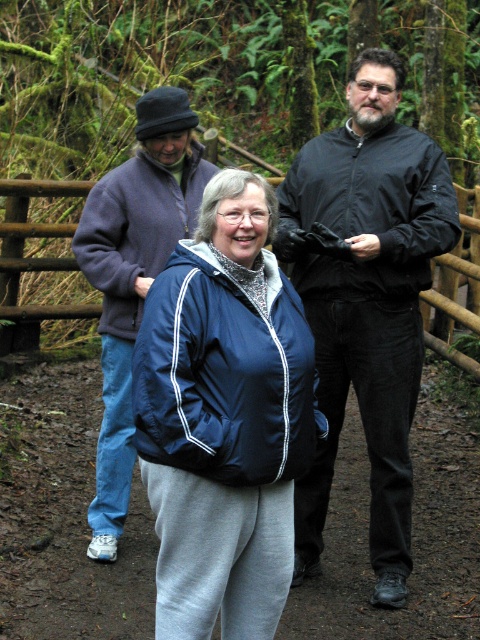
Question: Is black matte jacket at center further to the viewer compared to blue fleece jacket at center?

Choices:
 (A) no
 (B) yes

Answer: (A)

Question: Which of these objects is positioned farthest from the wooden fence at center?

Choices:
 (A) navy blue jacket at center
 (B) blue fleece jacket at center
 (C) black matte jacket at center

Answer: (A)

Question: Estimate the real-world distances between objects in this image. Which object is farther from the blue fleece jacket at center?

Choices:
 (A) black matte jacket at center
 (B) navy blue jacket at center
 (C) wooden fence at center

Answer: (C)

Question: Which of the following is the farthest from the observer?

Choices:
 (A) (244, 483)
 (B) (367, 195)
 (C) (127, 163)
 (D) (457, 307)

Answer: (D)

Question: Is navy blue jacket at center below blue fleece jacket at center?

Choices:
 (A) yes
 (B) no

Answer: (A)

Question: Where is blue fleece jacket at center located in relation to wooden fence at center in the image?

Choices:
 (A) right
 (B) left

Answer: (A)